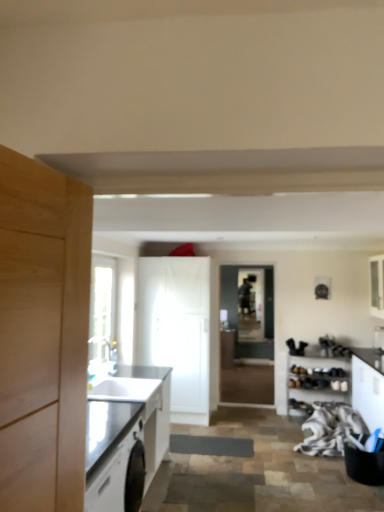
Question: Is white matte shoe rack at lower right, the 3th cabinetry in the right-to-left sequence, oriented away from matte black countertop at left, acting as the 5th cabinetry starting from the right?

Choices:
 (A) no
 (B) yes

Answer: (A)

Question: Considering the relative sizes of white matte shoe rack at lower right, the 3th cabinetry in the right-to-left sequence, and matte black countertop at left, positioned as the 1th cabinetry in left-to-right order, in the image provided, is white matte shoe rack at lower right, the 3th cabinetry in the right-to-left sequence, shorter than matte black countertop at left, positioned as the 1th cabinetry in left-to-right order,?

Choices:
 (A) no
 (B) yes

Answer: (B)

Question: From a real-world perspective, does white matte shoe rack at lower right, which appears as the 3th cabinetry when viewed from the left, stand above matte black countertop at left, positioned as the 1th cabinetry in left-to-right order?

Choices:
 (A) yes
 (B) no

Answer: (B)

Question: Can you confirm if white matte shoe rack at lower right, the 3th cabinetry in the right-to-left sequence, is smaller than matte black countertop at left, positioned as the 1th cabinetry in left-to-right order?

Choices:
 (A) no
 (B) yes

Answer: (B)

Question: From the image's perspective, is white matte shoe rack at lower right, which appears as the 3th cabinetry when viewed from the left, beneath matte black countertop at left, acting as the 5th cabinetry starting from the right?

Choices:
 (A) yes
 (B) no

Answer: (A)

Question: Is white matte shoe rack at lower right, the 3th cabinetry in the right-to-left sequence, thinner than matte black countertop at left, acting as the 5th cabinetry starting from the right?

Choices:
 (A) yes
 (B) no

Answer: (A)

Question: Is the position of matte black countertop at left, acting as the 5th cabinetry starting from the right, more distant than that of transparent glass door at center?

Choices:
 (A) yes
 (B) no

Answer: (B)

Question: Is matte black countertop at left, acting as the 5th cabinetry starting from the right, bigger than transparent glass door at center?

Choices:
 (A) no
 (B) yes

Answer: (B)

Question: From the image's perspective, is matte black countertop at left, positioned as the 1th cabinetry in left-to-right order, located above transparent glass door at center?

Choices:
 (A) yes
 (B) no

Answer: (B)

Question: From the image's perspective, is matte black countertop at left, positioned as the 1th cabinetry in left-to-right order, below transparent glass door at center?

Choices:
 (A) no
 (B) yes

Answer: (B)

Question: Is matte black countertop at left, acting as the 5th cabinetry starting from the right, shorter than transparent glass door at center?

Choices:
 (A) yes
 (B) no

Answer: (A)

Question: Considering the relative positions of matte black countertop at left, acting as the 5th cabinetry starting from the right, and transparent glass door at center in the image provided, is matte black countertop at left, acting as the 5th cabinetry starting from the right, in front of transparent glass door at center?

Choices:
 (A) no
 (B) yes

Answer: (B)

Question: Does matte black countertop at left, positioned as the 1th cabinetry in left-to-right order, have a greater height compared to white matte shoe rack at lower right, which appears as the 3th cabinetry when viewed from the left?

Choices:
 (A) yes
 (B) no

Answer: (A)